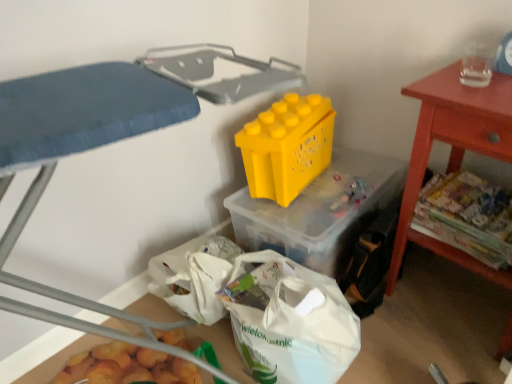
Question: Based on their positions, is smooth red table at right located to the left or right of white plastic bag at lower center, marked as the 2th storage box in a top-to-bottom arrangement?

Choices:
 (A) right
 (B) left

Answer: (A)

Question: Is smooth red table at right taller or shorter than white plastic bag at lower center, marked as the 2th storage box in a top-to-bottom arrangement?

Choices:
 (A) tall
 (B) short

Answer: (A)

Question: Which object is the closest to the smooth red table at right?

Choices:
 (A) white plastic bag at lower center, marked as the 2th storage box in a top-to-bottom arrangement
 (B) printed paper magazines at right
 (C) yellow plastic storage box at center, which appears as the 1th storage box when viewed from the top
 (D) yellow plastic storage bin at upper center
 (E) yellow plastic toy at center

Answer: (B)

Question: Which object is positioned closest to the white plastic bag at lower center, marked as the 2th storage box in a top-to-bottom arrangement?

Choices:
 (A) smooth red table at right
 (B) printed paper magazines at right
 (C) yellow plastic storage bin at upper center
 (D) yellow plastic toy at center
 (E) yellow plastic storage box at center, which appears as the 1th storage box when viewed from the top

Answer: (E)